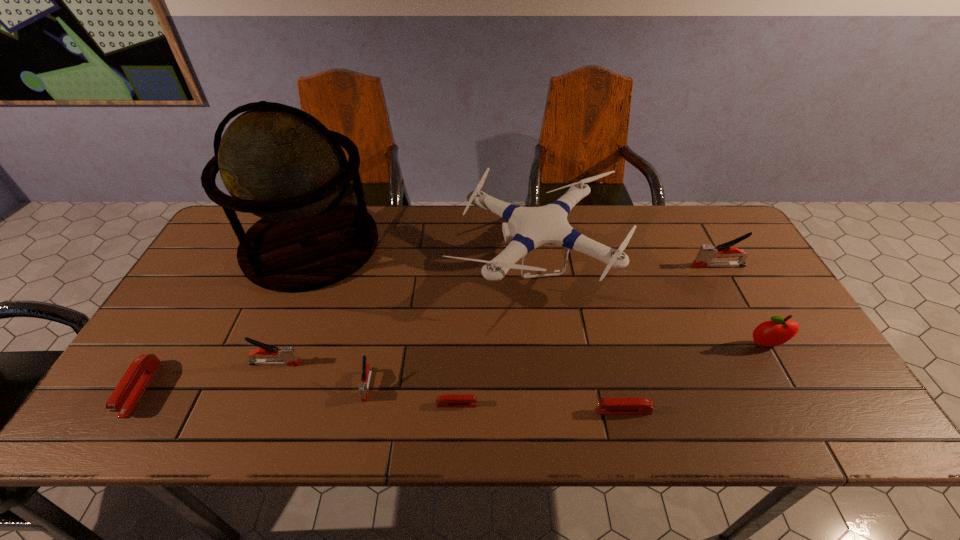
This screenshot has width=960, height=540. Find the location of `the tallest object`. the tallest object is located at coordinates (280, 163).

Find the location of a particular element. blue drone is located at coordinates (527, 228).

You are a GUI agent. You are given a task and a screenshot of the screen. Output one action in this format:
    pyautogui.click(x=<x>, y=<y>)
    Task: Click on the drone
    
    Given the screenshot: What is the action you would take?
    527,228

You are a GUI agent. You are given a task and a screenshot of the screen. Output one action in this format:
    pyautogui.click(x=<x>, y=<y>)
    Task: Click on the rightmost stapler
    The height and width of the screenshot is (540, 960).
    Given the screenshot: What is the action you would take?
    pyautogui.click(x=706, y=253)

In order to click on the rightmost gray stapler in this screenshot , I will do `click(706, 253)`.

Where is `the fourth farthest object`? the fourth farthest object is located at coordinates (777, 331).

Where is `the second stapler from left to right`? The height and width of the screenshot is (540, 960). the second stapler from left to right is located at coordinates (288, 355).

Find the location of `the second smallest gray stapler`. the second smallest gray stapler is located at coordinates (288, 355).

Find the location of a particular element. Image resolution: width=960 pixels, height=540 pixels. the sixth object from right to left is located at coordinates (367, 369).

The width and height of the screenshot is (960, 540). I want to click on the smallest gray stapler, so click(x=367, y=369).